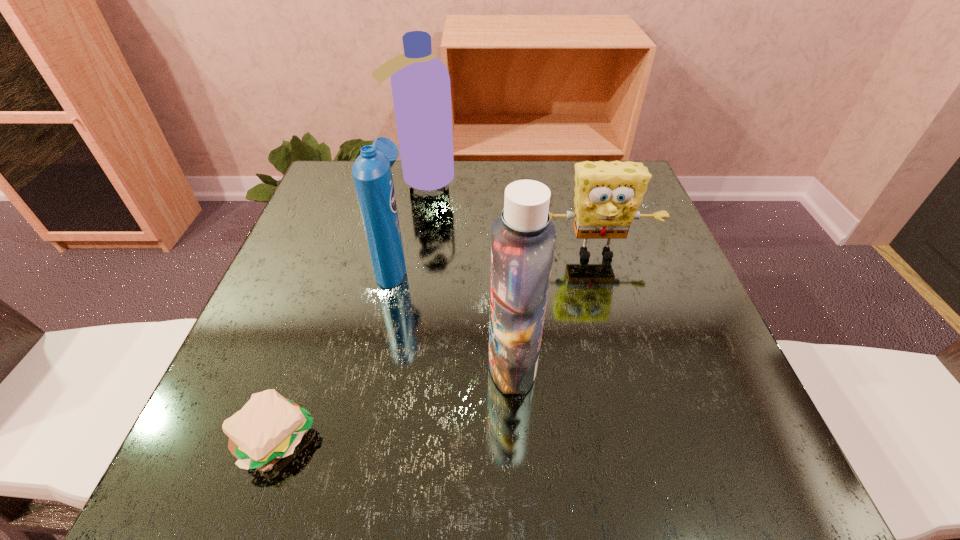
Find the location of a particular element. The image size is (960, 540). free space between the rightmost object and the nearest object is located at coordinates (436, 346).

I want to click on vacant space that's between the farthest object and the second nearest shampoo, so click(408, 221).

The width and height of the screenshot is (960, 540). I want to click on free space between the sponge and the nearest shampoo, so click(554, 308).

At what (x,y) coordinates should I click in order to perform the action: click on vacant area that lies between the second shortest object and the nearest object. Please return your answer as a coordinate pair (x, y). This screenshot has height=540, width=960. Looking at the image, I should click on (436, 346).

Select which object is the second closest to the leftmost object. Please provide its 2D coordinates. Your answer should be formatted as a tuple, i.e. [(x, y)], where the tuple contains the x and y coordinates of a point satisfying the conditions above.

[(523, 241)]

Where is `the second closest object to the fourth object from left to right`? The width and height of the screenshot is (960, 540). the second closest object to the fourth object from left to right is located at coordinates (371, 171).

You are a GUI agent. You are given a task and a screenshot of the screen. Output one action in this format:
    pyautogui.click(x=<x>, y=<y>)
    Task: Click on the shampoo that stands as the third closest to the sponge
    
    Given the screenshot: What is the action you would take?
    pyautogui.click(x=371, y=171)

I want to click on the closest shampoo relative to the fourth tallest object, so click(523, 241).